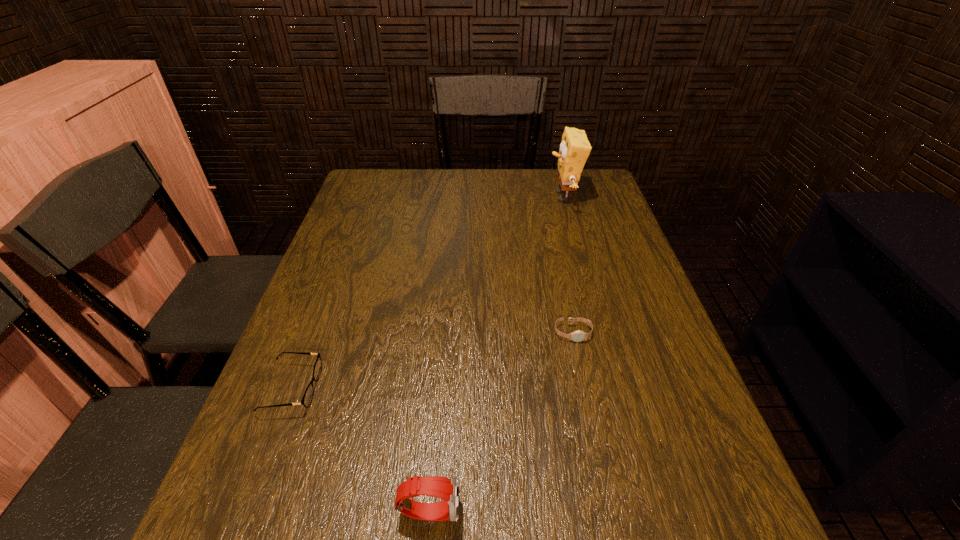
Locate an element on the screen. This screenshot has height=540, width=960. free space located on the face of the tallest object is located at coordinates (484, 197).

Where is `vacant region located on the face of the nearer watch`? vacant region located on the face of the nearer watch is located at coordinates (639, 510).

The height and width of the screenshot is (540, 960). I want to click on free space located on the front-facing side of the third farthest object, so click(466, 388).

What are the coordinates of `vacant point located 0.110m on the face of the farther watch` in the screenshot? It's located at (584, 384).

The image size is (960, 540). I want to click on object present at the far edge, so click(574, 150).

Locate an element on the screen. The width and height of the screenshot is (960, 540). object that is at the near edge is located at coordinates (448, 489).

This screenshot has height=540, width=960. I want to click on object positioned at the left edge, so click(x=307, y=398).

Locate an element on the screen. object that is positioned at the right edge is located at coordinates (574, 150).

Where is `object that is at the far right corner`? object that is at the far right corner is located at coordinates (574, 150).

The image size is (960, 540). I want to click on free space at the far edge, so click(523, 183).